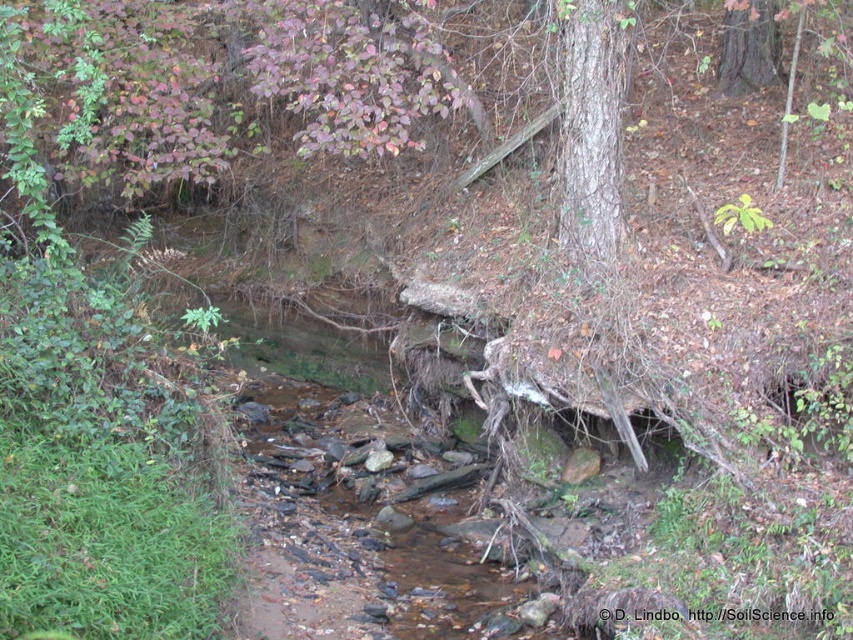
Is point (575, 225) more distant than point (753, 49)?

No, (575, 225) is closer to viewer.

Does point (614, 36) come farther from viewer compared to point (759, 35)?

No, it is not.

Find the location of a particular element. Image resolution: width=853 pixels, height=640 pixels. smooth bark tree at center is located at coordinates (590, 132).